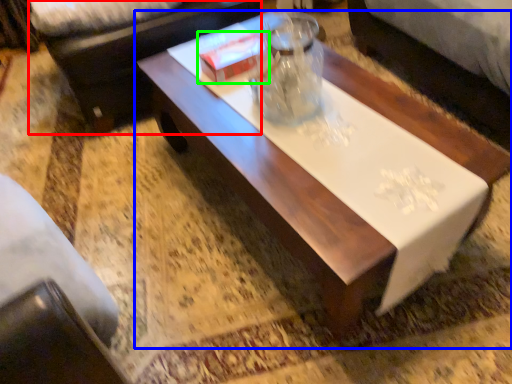
Question: Based on their relative distances, which object is farther from couch (highlighted by a red box)? Choose from coffee table (highlighted by a blue box) and box (highlighted by a green box).

Choices:
 (A) coffee table
 (B) box

Answer: (A)